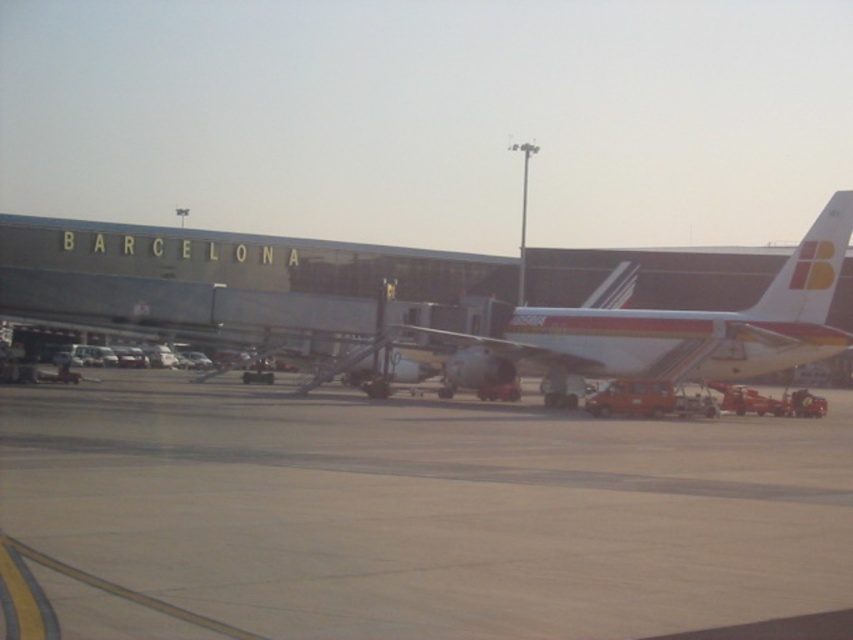
Question: Which object appears farthest from the camera in this image?

Choices:
 (A) brown concrete tarmac at center
 (B) white glossy airplane at center

Answer: (B)

Question: Does brown concrete tarmac at center have a greater width compared to white glossy airplane at center?

Choices:
 (A) no
 (B) yes

Answer: (B)

Question: Among these points, which one is farthest from the camera?

Choices:
 (A) (469, 452)
 (B) (549, 330)

Answer: (B)

Question: Observing the image, what is the correct spatial positioning of brown concrete tarmac at center in reference to white glossy airplane at center?

Choices:
 (A) right
 (B) left

Answer: (B)

Question: Can you confirm if brown concrete tarmac at center is positioned to the right of white glossy airplane at center?

Choices:
 (A) yes
 (B) no

Answer: (B)